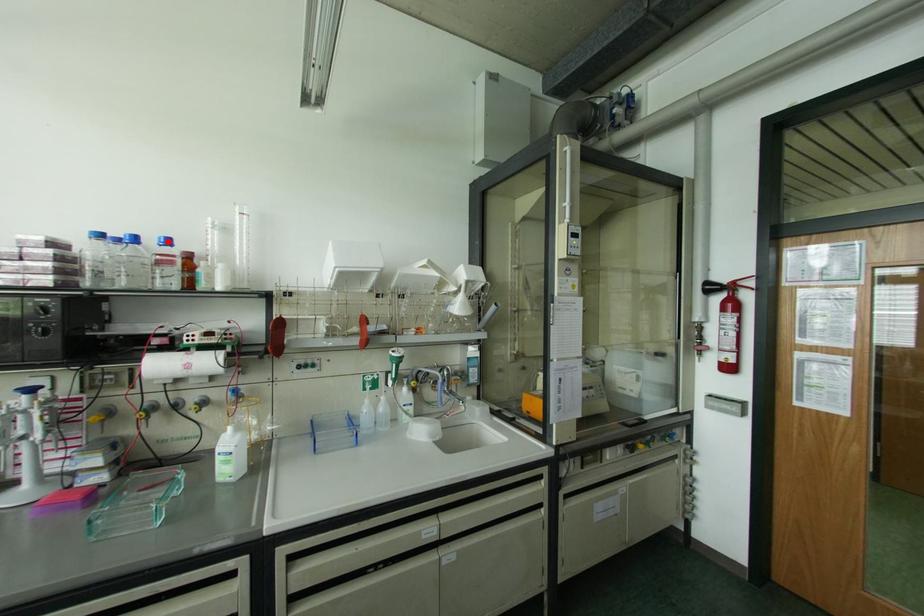
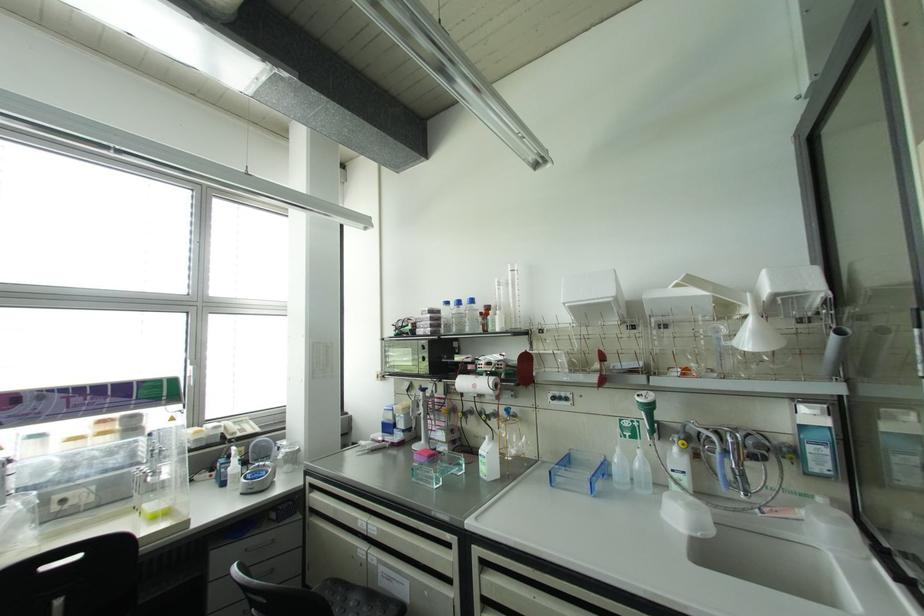
Find the pixel in the second image that matches the highlighted location in the first image.

(471, 301)